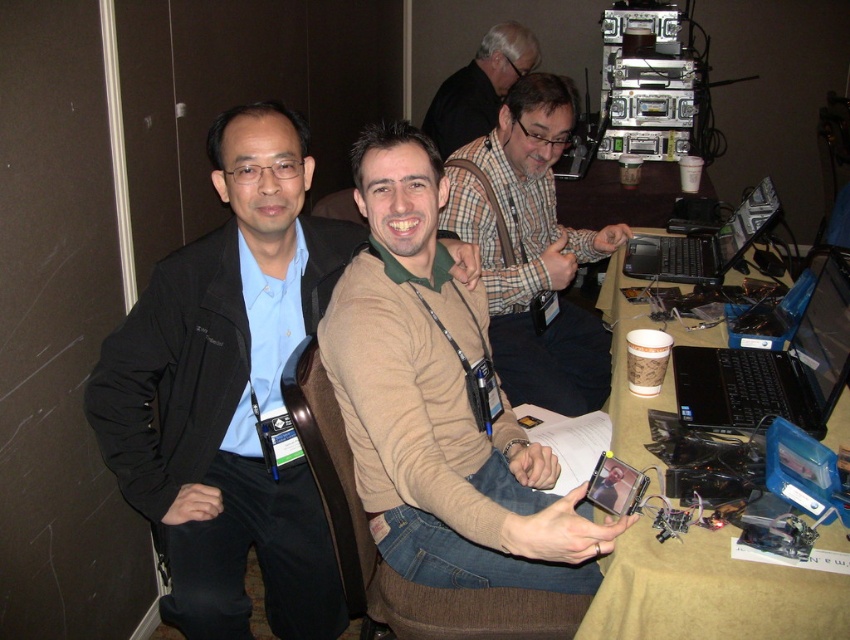
Question: Which of these objects is positioned farthest from the black plastic laptop at center?

Choices:
 (A) plaid shirt at upper center
 (B) plaid shirt at center

Answer: (A)

Question: Is plaid shirt at center further to the viewer compared to brown paper table at lower right?

Choices:
 (A) no
 (B) yes

Answer: (B)

Question: Observing the image, what is the correct spatial positioning of brown paper table at lower right in reference to black plastic laptop at center?

Choices:
 (A) left
 (B) right

Answer: (A)

Question: Which point appears farthest from the camera in this image?

Choices:
 (A) (497, 284)
 (B) (445, 150)
 (C) (839, 388)

Answer: (B)

Question: Is plaid shirt at upper center bigger than black plastic laptop at center right?

Choices:
 (A) yes
 (B) no

Answer: (A)

Question: Which point is farther to the camera?

Choices:
 (A) (612, 348)
 (B) (530, 250)
 (C) (468, 104)

Answer: (C)